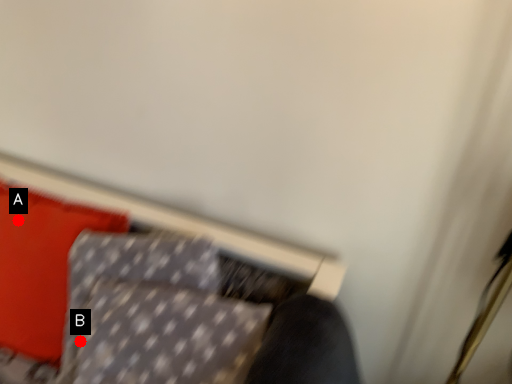
Question: Two points are circled on the image, labeled by A and B beside each circle. Which point is farther to the camera?

Choices:
 (A) A is further
 (B) B is further

Answer: (A)